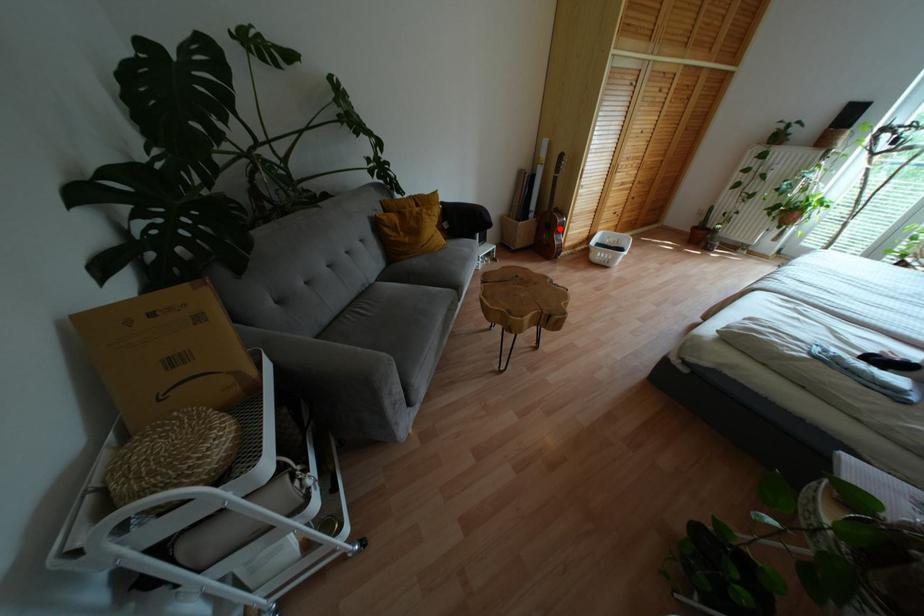
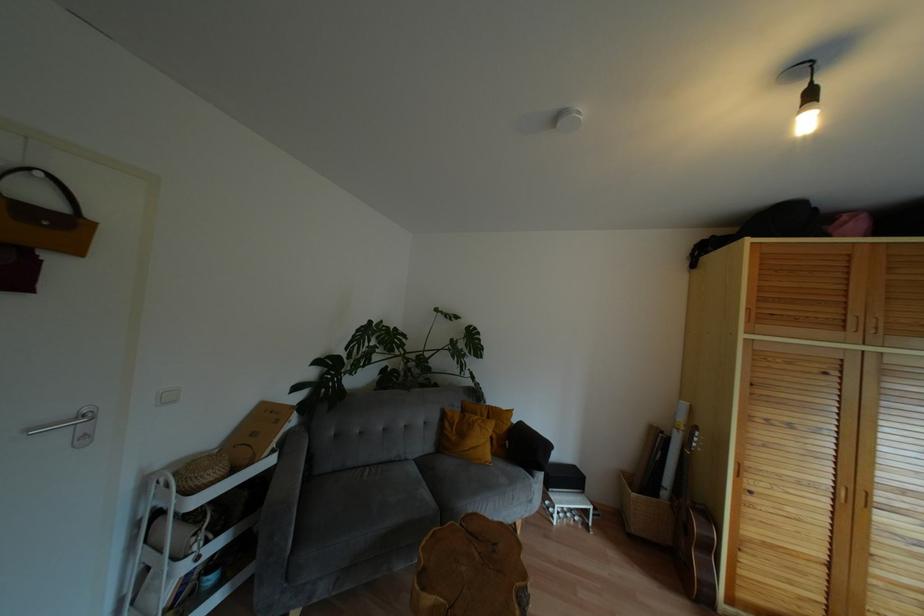
Find the pixel in the second image that matches the highlighted location in the first image.

(710, 548)